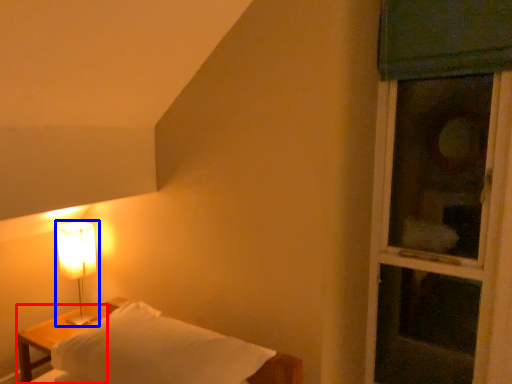
Question: Which object appears farthest to the camera in this image, nightstand (highlighted by a red box) or lamp (highlighted by a blue box)?

Choices:
 (A) nightstand
 (B) lamp

Answer: (B)